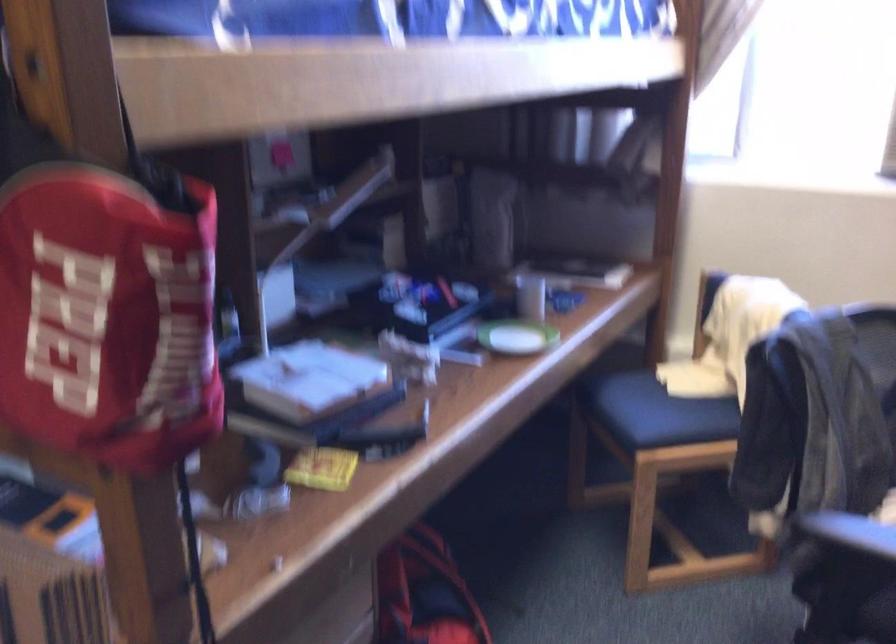
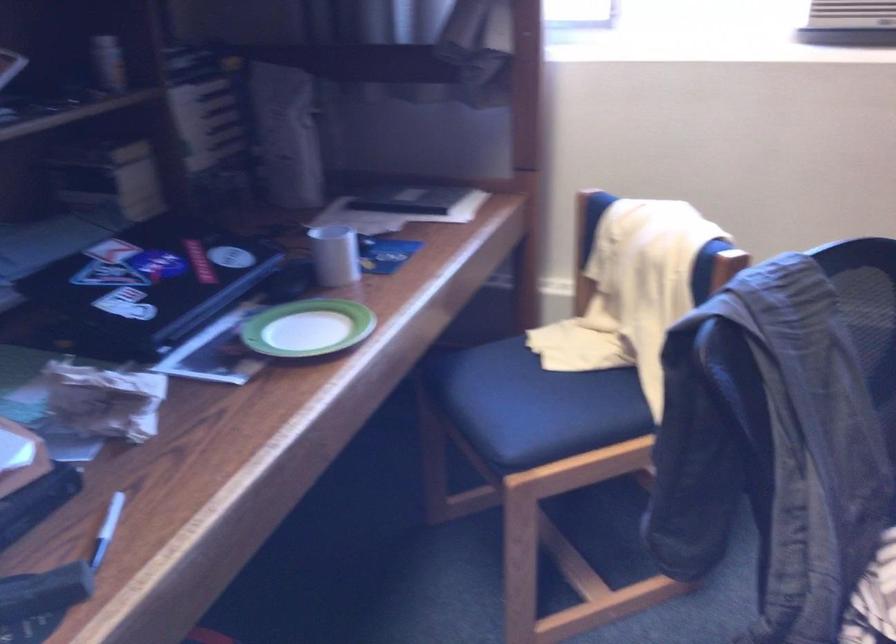
Locate, in the second image, the point that corresponds to the point at 410,426 in the first image.

(107, 529)